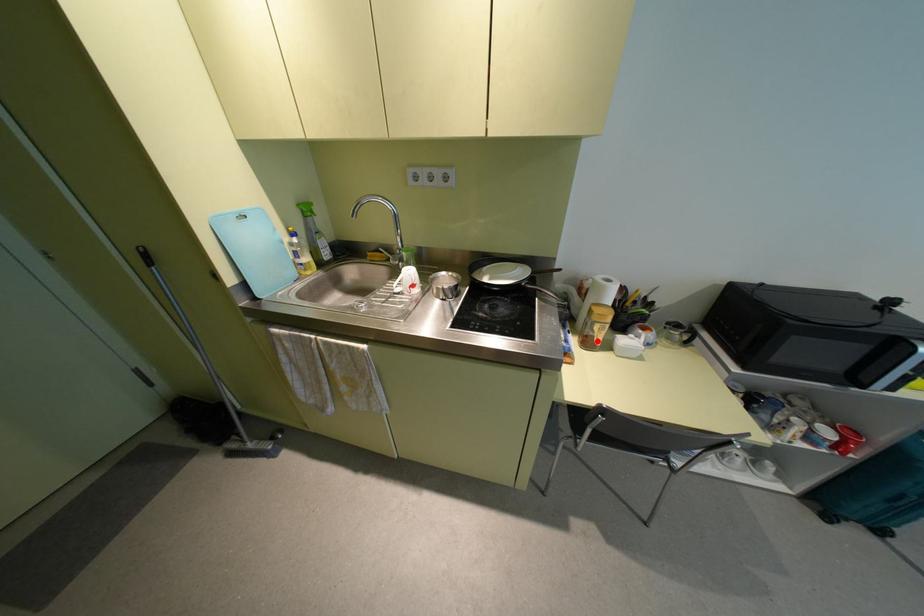
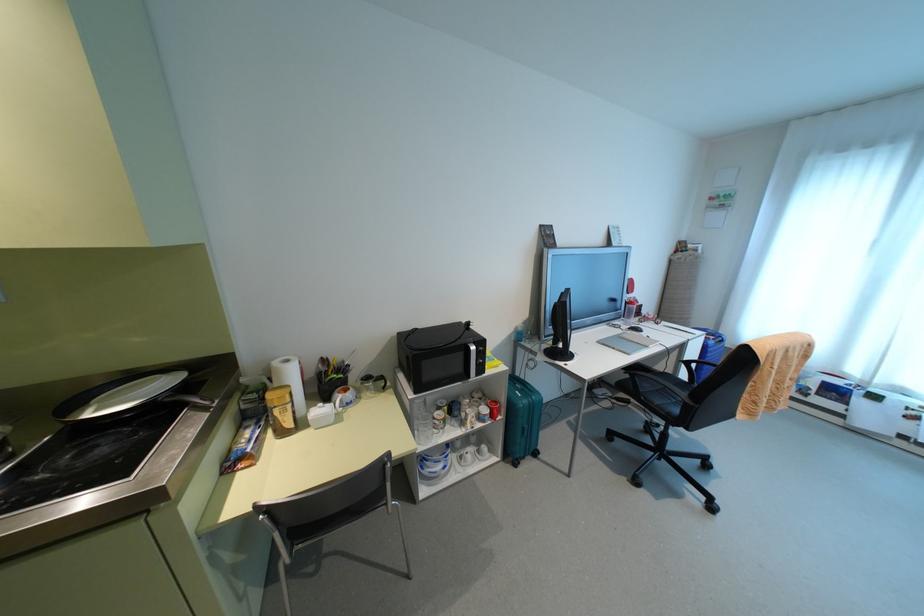
Where in the second image is the point corresponding to the highlighted location from the first image?

(288, 424)